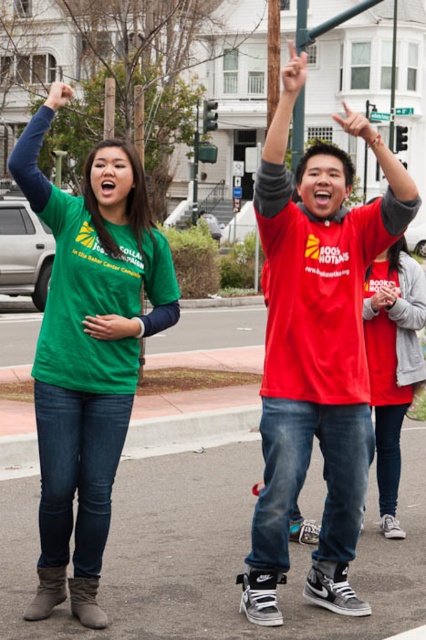
In the scene shown: Which is below, green matte t-shirt at left or matte red shirt at center?

matte red shirt at center

Between green matte t-shirt at left and matte red shirt at center, which one has less height?

matte red shirt at center

Between point (62, 493) and point (397, 445), which one is positioned behind?

Point (397, 445)

At what (x,y) coordinates should I click in order to perform the action: click on green matte t-shirt at left. Please return your answer as a coordinate pair (x, y). Looking at the image, I should click on (88, 348).

Who is more distant from viewer, (265, 496) or (402, 333)?

Positioned behind is point (402, 333).

Is matte red shirt at upper right bigger than matte red shirt at center?

Yes, matte red shirt at upper right is bigger than matte red shirt at center.

The width and height of the screenshot is (426, 640). I want to click on matte red shirt at upper right, so click(316, 349).

The image size is (426, 640). Identify the location of matte red shirt at upper right. (316, 349).

Consider the image. Which is below, matte red shirt at upper right or green matte t-shirt at left?

green matte t-shirt at left is lower down.

Is matte red shirt at upper right to the left of green matte t-shirt at left from the viewer's perspective?

No, matte red shirt at upper right is not to the left of green matte t-shirt at left.

Identify the location of matte red shirt at upper right. Image resolution: width=426 pixels, height=640 pixels. (316, 349).

Identify the location of matte red shirt at upper right. Image resolution: width=426 pixels, height=640 pixels. pyautogui.click(x=316, y=349).